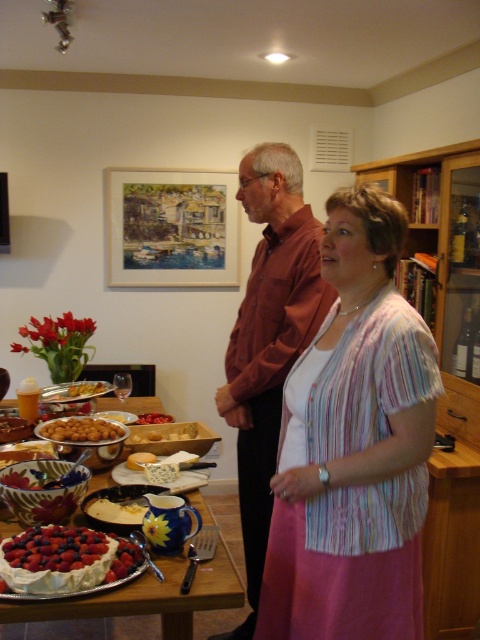
Can you confirm if striped fabric dress at center is thinner than yellow cheese at center?

Incorrect, striped fabric dress at center's width is not less than yellow cheese at center's.

This screenshot has width=480, height=640. Describe the element at coordinates (354, 445) in the screenshot. I see `striped fabric dress at center` at that location.

Does point (411, 628) come farther from viewer compared to point (151, 416)?

No, it is in front of (151, 416).

Where is `striped fabric dress at center`? The height and width of the screenshot is (640, 480). striped fabric dress at center is located at coordinates (354, 445).

Between matte white cake at center and ruffled white cake at lower left, which one appears on the right side from the viewer's perspective?

Positioned to the right is matte white cake at center.

Does matte white cake at center appear on the left side of ruffled white cake at lower left?

No, matte white cake at center is not to the left of ruffled white cake at lower left.

Who is more distant from viewer, (2, 621) or (113, 573)?

Positioned behind is point (113, 573).

You are a GUI agent. You are given a task and a screenshot of the screen. Output one action in this format:
    pyautogui.click(x=<x>, y=<y>)
    Task: Click on the matte white cake at center
    This screenshot has width=480, height=640.
    Given the screenshot: What is the action you would take?
    pyautogui.click(x=155, y=596)

Can you confirm if golden brown bread at center is shorter than yellow cheese at center?

Incorrect, golden brown bread at center's height does not fall short of yellow cheese at center's.

Between point (101, 387) and point (163, 412), which one is positioned behind?

The point (163, 412) is more distant.

Find the location of a particular element. Image resolution: width=480 pixels, height=640 pixels. golden brown bread at center is located at coordinates (87, 388).